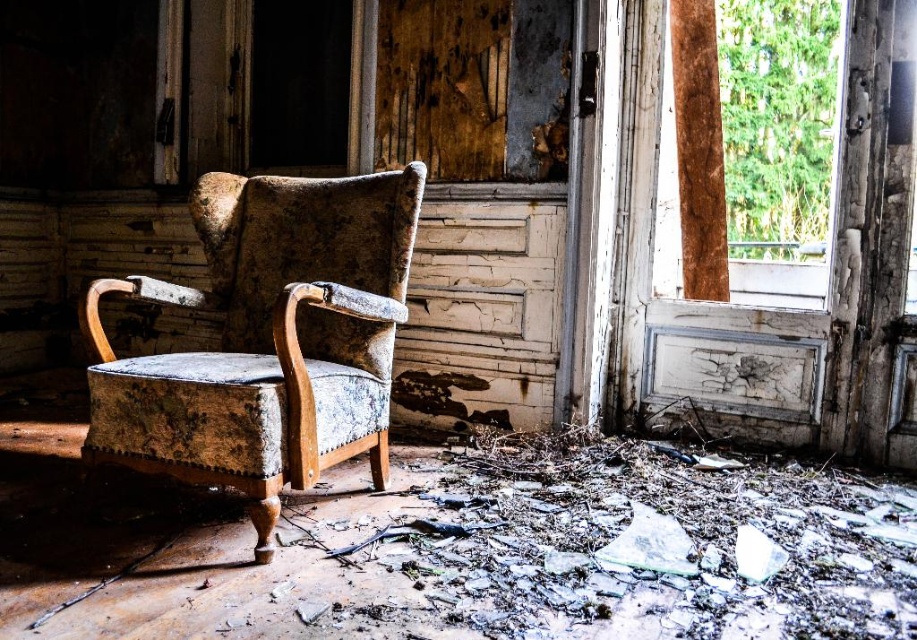
Question: Which object appears closest to the camera in this image?

Choices:
 (A) distressed velvet armchair at center
 (B) wooden frame at right

Answer: (A)

Question: Among these points, which one is farthest from the camera?

Choices:
 (A) (783, 90)
 (B) (381, 368)

Answer: (A)

Question: Is distressed velvet armchair at center above wooden frame at right?

Choices:
 (A) yes
 (B) no

Answer: (B)

Question: Can you confirm if distressed velvet armchair at center is positioned to the left of wooden frame at right?

Choices:
 (A) no
 (B) yes

Answer: (B)

Question: Is distressed velvet armchair at center smaller than wooden frame at right?

Choices:
 (A) no
 (B) yes

Answer: (A)